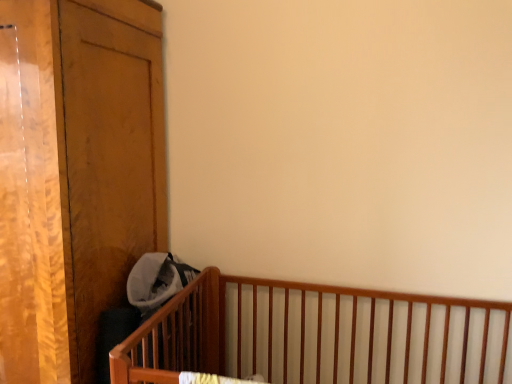
Describe the element at coordinates (75, 175) in the screenshot. Image resolution: width=512 pixels, height=384 pixels. I see `wooden dresser at left` at that location.

Where is `wooden dresser at left`? This screenshot has height=384, width=512. wooden dresser at left is located at coordinates (75, 175).

Measure the distance between point (x=31, y=219) and camera.

Point (x=31, y=219) is 1.30 meters from camera.

Locate an element on the screen. Image resolution: width=512 pixels, height=384 pixels. wooden dresser at left is located at coordinates (75, 175).